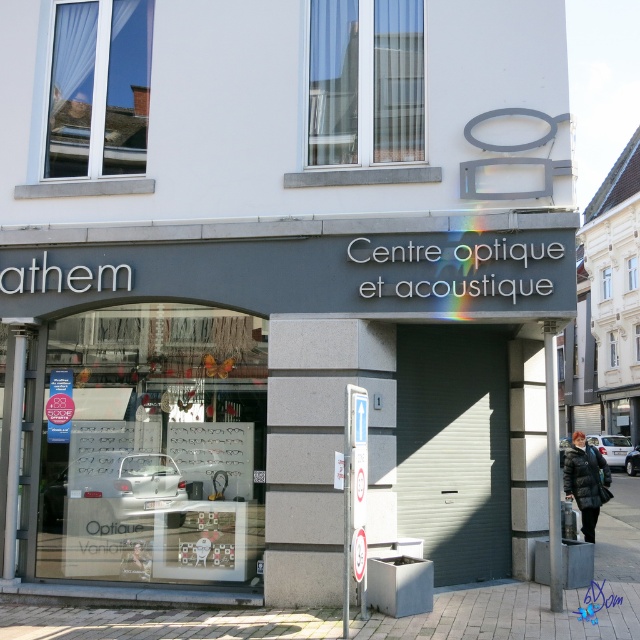
Question: Which object is the farthest from the dark blue puffer jacket at lower right?

Choices:
 (A) matte gray storefront at center
 (B) brick pavement at lower center

Answer: (A)

Question: Observing the image, what is the correct spatial positioning of brick pavement at lower center in reference to dark blue puffer jacket at lower right?

Choices:
 (A) below
 (B) above

Answer: (B)

Question: Does brick pavement at lower center have a greater width compared to dark blue puffer jacket at lower right?

Choices:
 (A) no
 (B) yes

Answer: (A)

Question: Is matte gray storefront at center smaller than brick pavement at lower center?

Choices:
 (A) no
 (B) yes

Answer: (B)

Question: Which point is closer to the camera?

Choices:
 (A) (550, 637)
 (B) (145, 353)

Answer: (A)

Question: Among these objects, which one is farthest from the camera?

Choices:
 (A) dark blue puffer jacket at lower right
 (B) matte gray storefront at center
 (C) brick pavement at lower center

Answer: (A)